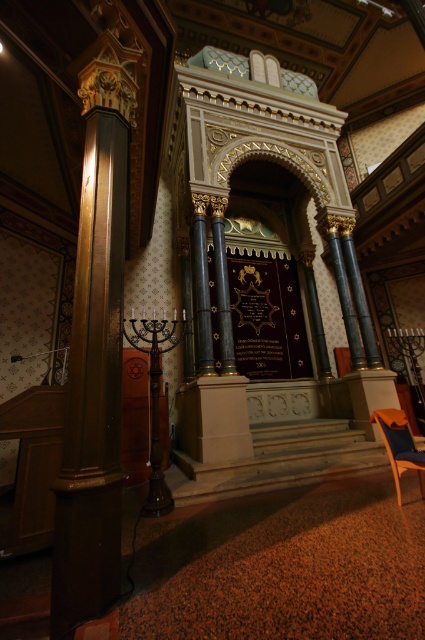
Question: Can you confirm if dark wood column at left is wider than wooden armchair at lower right?

Choices:
 (A) yes
 (B) no

Answer: (A)

Question: Is dark wood column at left to the left of wooden armchair at lower right from the viewer's perspective?

Choices:
 (A) no
 (B) yes

Answer: (B)

Question: Does dark wood column at left have a smaller size compared to wooden armchair at lower right?

Choices:
 (A) yes
 (B) no

Answer: (B)

Question: Among these objects, which one is farthest from the camera?

Choices:
 (A) wooden armchair at lower right
 (B) dark wood column at left

Answer: (A)

Question: Which point is closer to the camera taking this photo?

Choices:
 (A) (x=115, y=451)
 (B) (x=397, y=492)

Answer: (A)